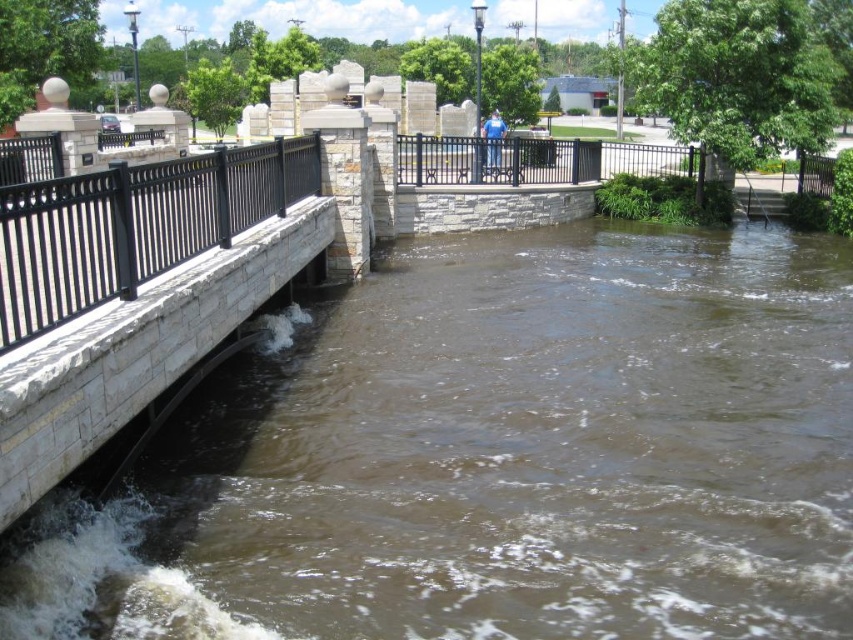
You are a delivery robot with a width of 1.2 meters. You need to cross the flooded area shown in the image. There is a brown stone river at center and a black metal fence at left. Can you pass between them safely?

The brown stone river at center and black metal fence at left are 4.77 meters apart. Since your width is 1.2 meters, there is enough space to pass safely between them.

You are a construction worker tasked with installing a new safety barrier between the black metal fence at left and the black metal fence at center. The barrier requires a minimum of 15 meters of space to be installed properly. Can the barrier be installed between these two fences?

The distance between the black metal fence at left and the black metal fence at center is 15.10 meters, which is just over the required 15 meters. Therefore, the safety barrier can be installed between them.

In the scene shown: You are a safety inspector assessing the flooded area. You see the brown stone river at center and the black metal fence at center. Which object is bigger in size?

The brown stone river at center has a larger size compared to the black metal fence at center.